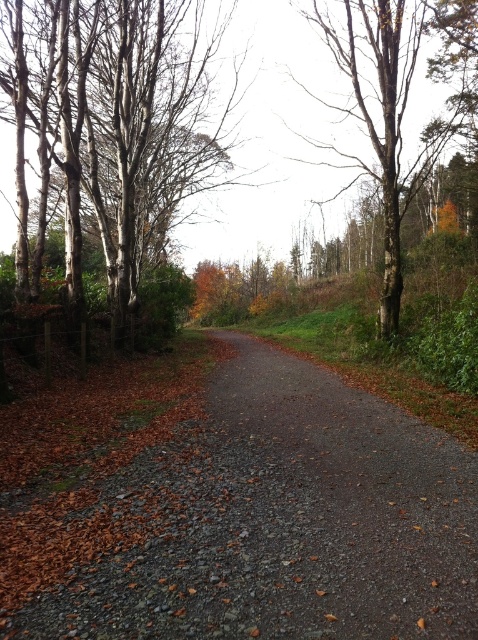
You are a hiker walking along the gravel path and want to reach the tree at the upper right. Which direction should you move to get closer to the bare bark tree at upper right while avoiding the smooth white bark at left?

To reach the bare bark tree at upper right while avoiding the smooth white bark at left, you should move to the right side of the path. The smooth white bark at left is in front of the bare bark tree at upper right, so moving right would allow you to bypass the obstruction on the left side.

You are a hiker trying to follow the path through the forest. You see the brown gravel trail at center and the bare bark tree at upper right. Which one is closer to you?

The brown gravel trail at center is closer to the viewer than the bare bark tree at upper right, so the trail is closer.

You are a hiker carrying a backpack and want to take a photo of both the smooth white bark at left and the bare bark tree at upper right in the same frame. The camera you have can capture a maximum distance of 10 meters between the closest and farthest objects. Will you be able to include both in your photo?

The smooth white bark at left is 8.00 meters away from the bare bark tree at upper right. Since the camera can capture up to 10 meters between objects, you can include both in the same frame as the distance is within the camera range.